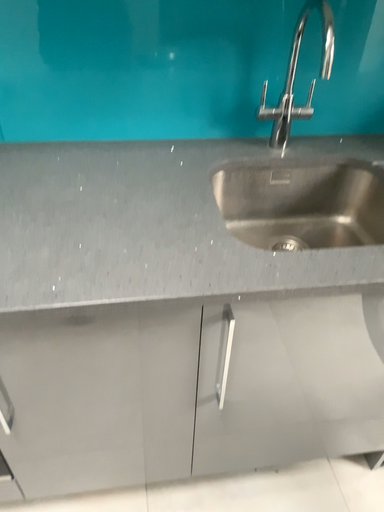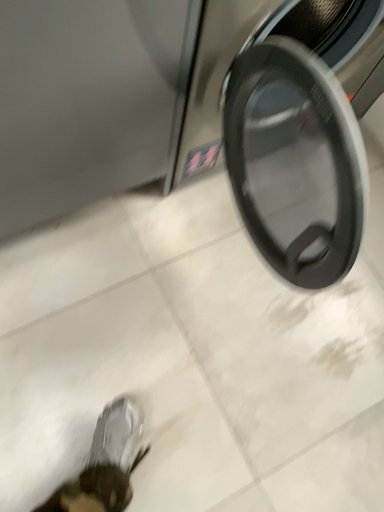
Question: How did the camera likely rotate when shooting the video?

Choices:
 (A) rotated upward
 (B) rotated downward

Answer: (B)